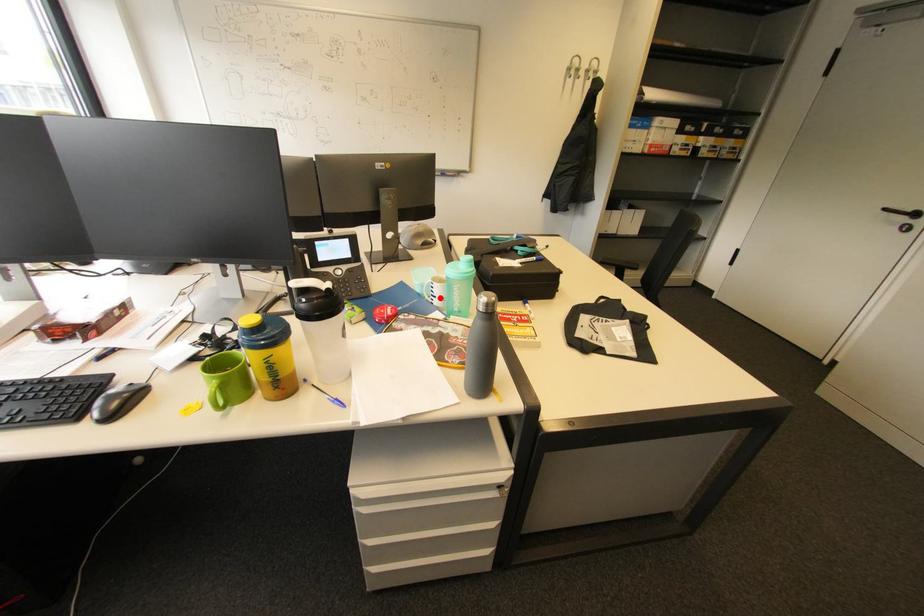
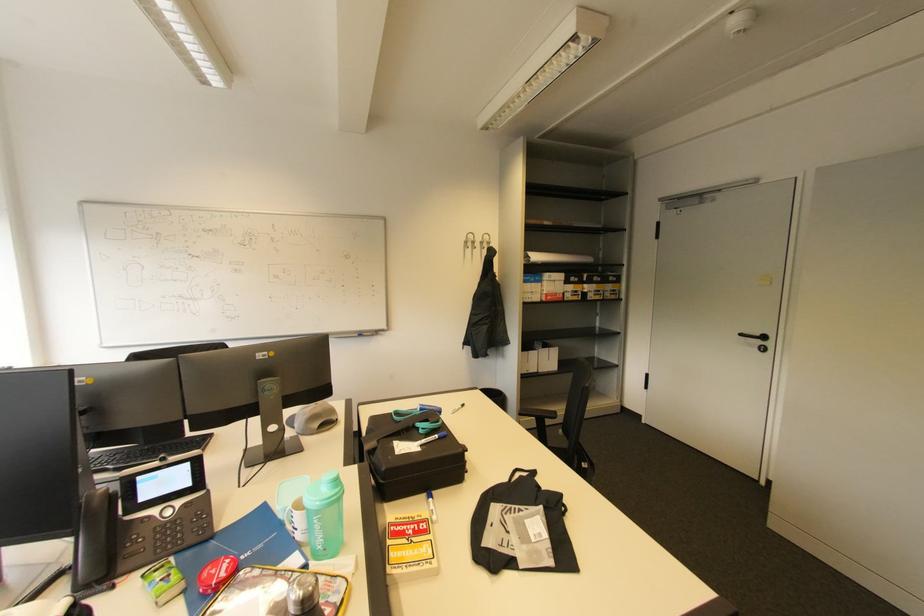
The point at the highlighted location is marked in the first image. Where is the corresponding point in the second image?

(300, 531)